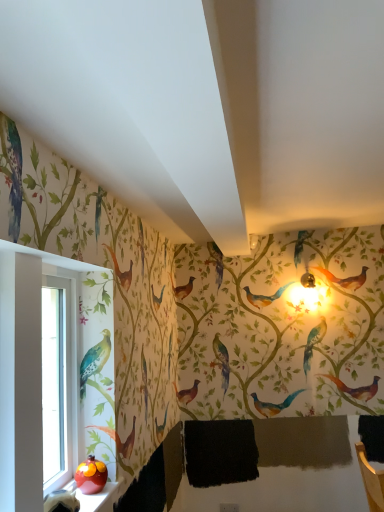
Describe the element at coordinates (41, 367) in the screenshot. The height and width of the screenshot is (512, 384). I see `clear glass window at left` at that location.

Where is `clear glass window at left`? clear glass window at left is located at coordinates (41, 367).

Find the location of `clear glass window at left`. clear glass window at left is located at coordinates (41, 367).